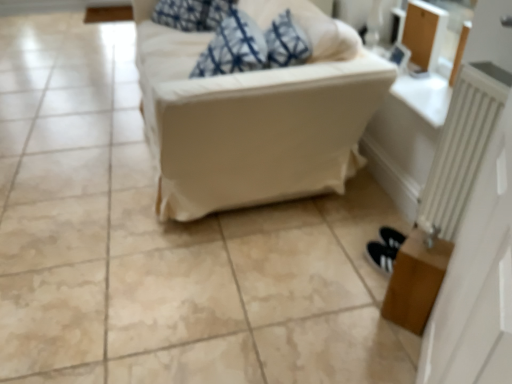
You are a GUI agent. You are given a task and a screenshot of the screen. Output one action in this format:
    pyautogui.click(x=<x>, y=<y>)
    Task: Click on the free spot behind brown wooden table at lower right
    
    Given the screenshot: What is the action you would take?
    pyautogui.click(x=364, y=274)